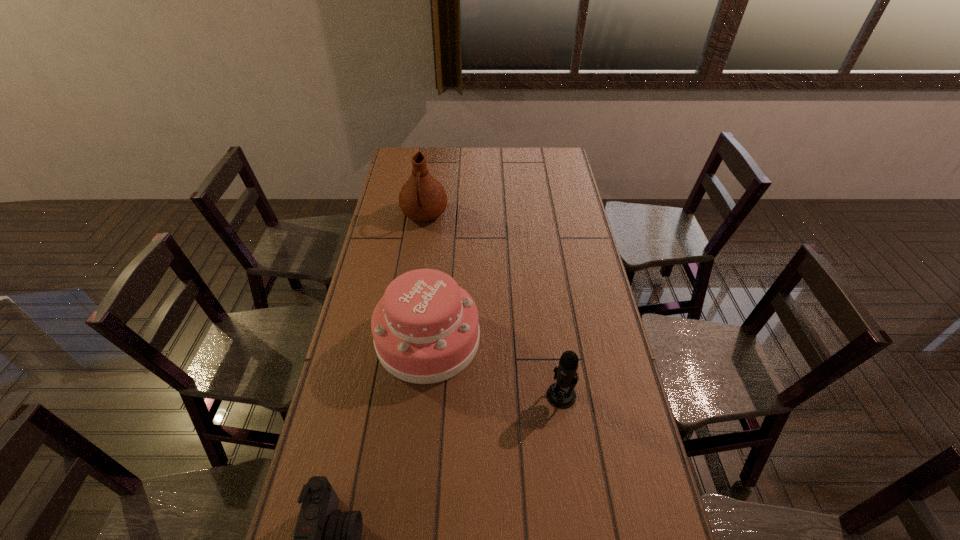
Where is `free spot at the far edge of the desktop`? This screenshot has width=960, height=540. free spot at the far edge of the desktop is located at coordinates (x=516, y=158).

What are the coordinates of `vacant space at the left edge of the desktop` in the screenshot? It's located at (355, 372).

In the image, there is a desktop. At what (x,y) coordinates should I click in order to perform the action: click on vacant area at the right edge. Please return your answer as a coordinate pair (x, y). The width and height of the screenshot is (960, 540). Looking at the image, I should click on (560, 233).

At what (x,y) coordinates should I click in order to perform the action: click on vacant region at the far right corner of the desktop. Please return your answer as a coordinate pair (x, y). Looking at the image, I should click on (562, 147).

Find the location of a particular element. This screenshot has height=540, width=960. vacant area between the farthest object and the microphone is located at coordinates (492, 305).

At what (x,y) coordinates should I click in order to perform the action: click on free space between the tallest object and the microphone. Please return your answer as a coordinate pair (x, y). Looking at the image, I should click on (492, 305).

Find the location of `free point between the birthday cake and the rightmost object`. free point between the birthday cake and the rightmost object is located at coordinates [x=494, y=367].

Find the location of a particular element. free point between the farthest object and the microphone is located at coordinates (492, 305).

Locate an element on the screen. The image size is (960, 540). the third closest object to the birthday cake is located at coordinates (422, 198).

Where is `the second closest object to the birthday cake`? The height and width of the screenshot is (540, 960). the second closest object to the birthday cake is located at coordinates (326, 539).